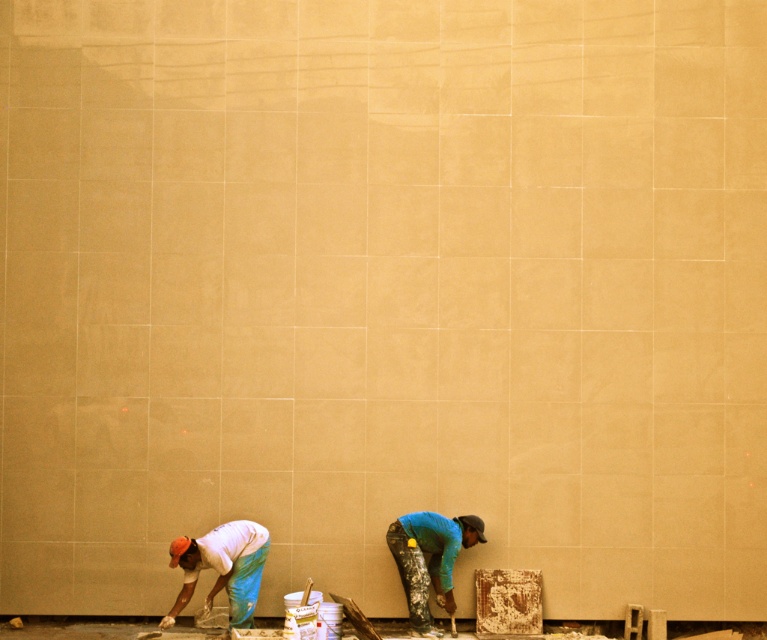
You are a GUI agent. You are given a task and a screenshot of the screen. Output one action in this format:
    pyautogui.click(x=<x>, y=<y>)
    Task: Click on the white matte shirt at lower left
    This screenshot has width=767, height=640.
    Given the screenshot: What is the action you would take?
    tap(222, 566)

This screenshot has width=767, height=640. In order to click on white matte shirt at lower left in this screenshot , I will do `click(222, 566)`.